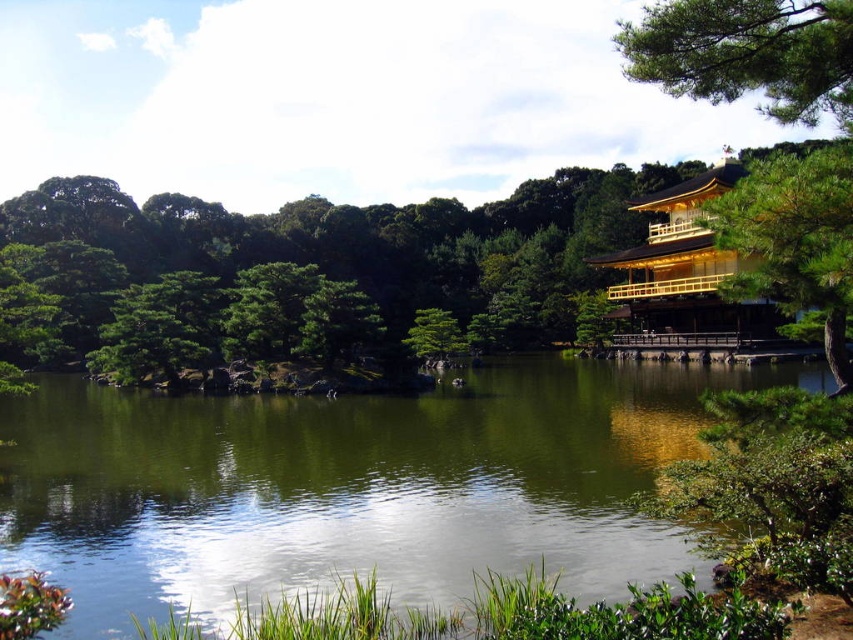
You are standing in front of the Golden Pavilion and want to take a photo of both the green liquid water at center and the green pine tree at upper right. Can you frame both objects in the same shot without moving your camera?

The green liquid water at center is positioned on the left side of green pine tree at upper right, so yes, you can frame both objects in the same shot without moving your camera since they are aligned horizontally.

You are a tourist visiting the Golden Pavilion and want to take a photo that includes both the green liquid water at center and the golden polished wood temple at right. Based on their heights, which object should you focus on first to ensure both are in the frame?

The green liquid water at center has a lesser height compared to the golden polished wood temple at right. To ensure both are in the frame, focus on the golden polished wood temple at right first since it is taller and will require more vertical space.